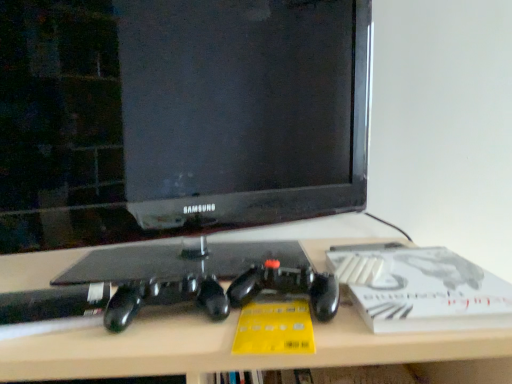
What do you see at coordinates (227, 349) in the screenshot? The height and width of the screenshot is (384, 512). I see `matte black desk at center` at bounding box center [227, 349].

Describe the element at coordinates (420, 289) in the screenshot. The width and height of the screenshot is (512, 384). I see `white matte paperback book at right` at that location.

Locate an element on the screen. The image size is (512, 384). black glossy monitor at center is located at coordinates (178, 116).

Does black glossy monitor at center have a greater height compared to matte black desk at center?

Correct, black glossy monitor at center is much taller as matte black desk at center.

Looking at this image, is black glossy monitor at center turned away from matte black desk at center?

No, black glossy monitor at center is not facing away from matte black desk at center.

Is black glossy monitor at center bigger than matte black desk at center?

Incorrect, black glossy monitor at center is not larger than matte black desk at center.

Is matte black desk at center closer to camera compared to black glossy monitor at center?

Yes, the depth of matte black desk at center is less than that of black glossy monitor at center.

Is matte black desk at center taller or shorter than black glossy monitor at center?

Clearly, matte black desk at center is shorter compared to black glossy monitor at center.

Is matte black desk at center turned away from black glossy monitor at center?

matte black desk at center is not turned away from black glossy monitor at center.

Is point (443, 352) closer or farther from the camera than point (90, 206)?

Point (443, 352) is positioned closer to the camera compared to point (90, 206).

This screenshot has width=512, height=384. What are the coordinates of `television behind the white matte paperback book at right` in the screenshot? It's located at (178, 116).

How much distance is there between black glossy monitor at center and white matte paperback book at right?

The distance of black glossy monitor at center from white matte paperback book at right is 14.46 inches.

Does black glossy monitor at center turn towards white matte paperback book at right?

Yes, black glossy monitor at center faces towards white matte paperback book at right.

In the scene shown: Which object is positioned more to the left, black glossy monitor at center or white matte paperback book at right?

Positioned to the left is black glossy monitor at center.

Can you confirm if white matte paperback book at right is shorter than black glossy monitor at center?

Indeed, white matte paperback book at right has a lesser height compared to black glossy monitor at center.

From the picture: Which object is further away from the camera, white matte paperback book at right or black glossy monitor at center?

Positioned behind is black glossy monitor at center.

Based on their sizes in the image, would you say white matte paperback book at right is bigger or smaller than black glossy monitor at center?

Clearly, white matte paperback book at right is smaller in size than black glossy monitor at center.

Are white matte paperback book at right and black glossy monitor at center making contact?

No, white matte paperback book at right is not with black glossy monitor at center.

Is white matte paperback book at right a part of matte black desk at center?

Yes, white matte paperback book at right is a part of matte black desk at center.

You are a GUI agent. You are given a task and a screenshot of the screen. Output one action in this format:
    pyautogui.click(x=<x>, y=<y>)
    Task: Click on the paperback book to the right of matte black desk at center
    
    Given the screenshot: What is the action you would take?
    pyautogui.click(x=420, y=289)

From the image's perspective, is matte black desk at center over white matte paperback book at right?

No, from the image's perspective, matte black desk at center is not over white matte paperback book at right.

Considering the relative positions of matte black desk at center and white matte paperback book at right in the image provided, is matte black desk at center to the left or to the right of white matte paperback book at right?

Clearly, matte black desk at center is on the left of white matte paperback book at right in the image.

Who is smaller, white matte paperback book at right or matte black desk at center?

Smaller between the two is white matte paperback book at right.

Based on the photo, is white matte paperback book at right positioned behind matte black desk at center?

Yes.

Where is `desk that is on the left side of white matte paperback book at right`? The height and width of the screenshot is (384, 512). desk that is on the left side of white matte paperback book at right is located at coordinates (227, 349).

From a real-world perspective, which is physically below, white matte paperback book at right or matte black desk at center?

matte black desk at center.

The width and height of the screenshot is (512, 384). In the image, there is a matte black desk at center. Find the location of `television above it (from the image's perspective)`. television above it (from the image's perspective) is located at coordinates (178, 116).

Where is `desk lying below the black glossy monitor at center (from the image's perspective)`? desk lying below the black glossy monitor at center (from the image's perspective) is located at coordinates (227, 349).

Estimate the real-world distances between objects in this image. Which object is closer to matte black desk at center, black glossy monitor at center or white matte paperback book at right?

Among the two, white matte paperback book at right is located nearer to matte black desk at center.

Which object lies further to the anchor point matte black desk at center, white matte paperback book at right or black glossy monitor at center?

black glossy monitor at center is positioned further to the anchor matte black desk at center.

Looking at the image, which one is located further to black glossy monitor at center, matte black desk at center or white matte paperback book at right?

Based on the image, matte black desk at center appears to be further to black glossy monitor at center.

When comparing their distances from white matte paperback book at right, does matte black desk at center or black glossy monitor at center seem further?

black glossy monitor at center is positioned further to the anchor white matte paperback book at right.

Based on their spatial positions, is white matte paperback book at right or matte black desk at center closer to black glossy monitor at center?

Among the two, white matte paperback book at right is located nearer to black glossy monitor at center.

Based on their spatial positions, is black glossy monitor at center or matte black desk at center further from white matte paperback book at right?

black glossy monitor at center is positioned further to the anchor white matte paperback book at right.

This screenshot has width=512, height=384. In order to click on paperback book between black glossy monitor at center and matte black desk at center vertically in this screenshot , I will do `click(420, 289)`.